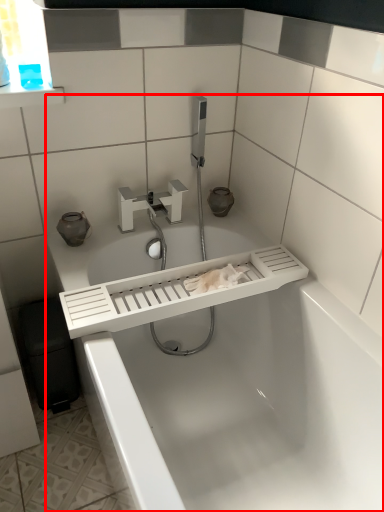
Question: From the image's perspective, considering the relative positions of bathtub (annotated by the red box) and tap in the image provided, where is bathtub (annotated by the red box) located with respect to the staircase?

Choices:
 (A) above
 (B) below

Answer: (B)